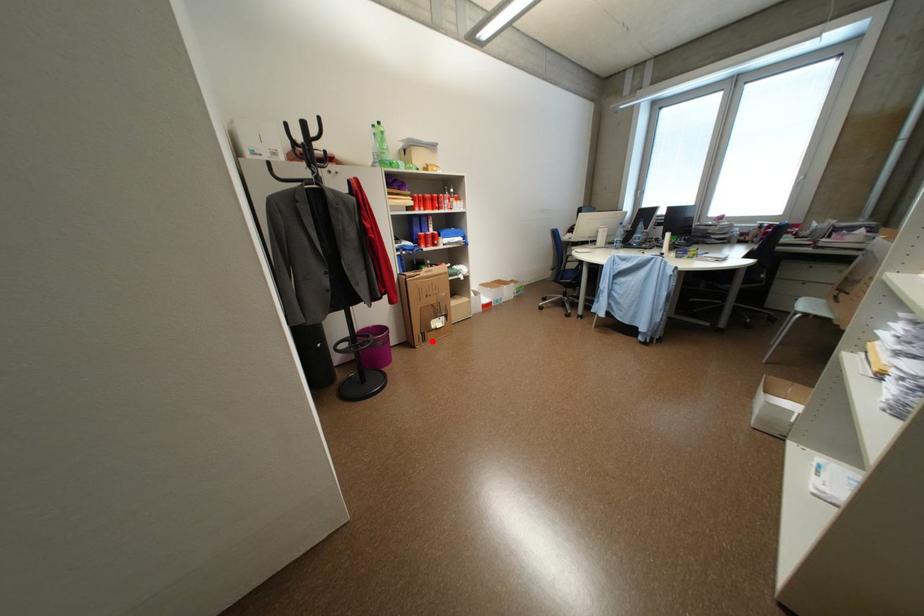
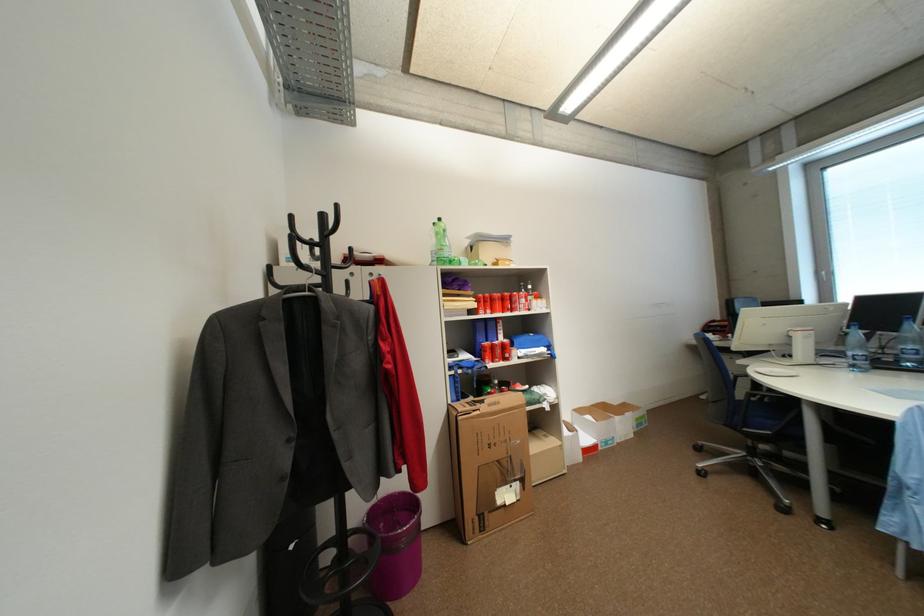
Question: A red point is marked in image1. In image2, is the corresponding 3D point closer to the camera or farther? Reply with the corresponding letter.

Choices:
 (A) The corresponding 3D point is closer.
 (B) The corresponding 3D point is farther.

Answer: (B)